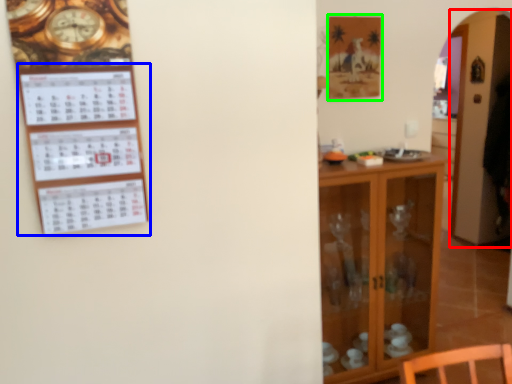
Question: Which is nearer to the glass door (highlighted by a red box)? bulletin board (highlighted by a blue box) or picture frame (highlighted by a green box).

Choices:
 (A) bulletin board
 (B) picture frame

Answer: (B)